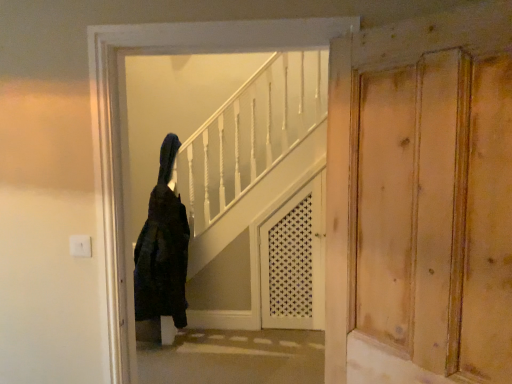
What are the coordinates of `white lattice screen door at center` in the screenshot? It's located at (294, 260).

This screenshot has height=384, width=512. Describe the element at coordinates (163, 248) in the screenshot. I see `black fuzzy coat at center` at that location.

The width and height of the screenshot is (512, 384). I want to click on black fuzzy coat at center, so click(x=163, y=248).

This screenshot has width=512, height=384. In order to click on white lattice screen door at center in this screenshot , I will do `click(294, 260)`.

Considering the relative sizes of black fuzzy coat at center and natural wood door at right in the image provided, is black fuzzy coat at center smaller than natural wood door at right?

No.

Which is nearer, (152, 244) or (340, 203)?

The point (340, 203) is more forward.

Would you consider black fuzzy coat at center to be distant from natural wood door at right?

Yes, black fuzzy coat at center and natural wood door at right are located far from each other.

How far apart are black fuzzy coat at center and natural wood door at right?

They are 1.97 meters apart.

Consider the image. Does white lattice screen door at center have a greater width compared to black fuzzy coat at center?

In fact, white lattice screen door at center might be narrower than black fuzzy coat at center.

Is black fuzzy coat at center inside white lattice screen door at center?

No, black fuzzy coat at center is located outside of white lattice screen door at center.

Considering the sizes of white lattice screen door at center and black fuzzy coat at center in the image, is white lattice screen door at center taller or shorter than black fuzzy coat at center?

Considering their sizes, white lattice screen door at center has more height than black fuzzy coat at center.

Does white lattice screen door at center have a smaller size compared to natural wood door at right?

No.

How much distance is there between white lattice screen door at center and natural wood door at right?

6.39 feet.

Is point (316, 186) positioned before point (494, 49)?

No, (316, 186) is further to viewer.

Is white lattice screen door at center touching natural wood door at right?

white lattice screen door at center and natural wood door at right are not in contact.

Between natural wood door at right and black fuzzy coat at center, which one has less height?

With less height is natural wood door at right.

Is natural wood door at right far from black fuzzy coat at center?

Yes, natural wood door at right and black fuzzy coat at center are quite far apart.

Does point (335, 287) lie behind point (170, 274)?

No, it is not.

Which object is further away from the camera, natural wood door at right or black fuzzy coat at center?

black fuzzy coat at center.

The image size is (512, 384). In order to click on screen door below the natural wood door at right (from a real-world perspective) in this screenshot , I will do `click(294, 260)`.

From the image's perspective, between natural wood door at right and white lattice screen door at center, which one is located above?

natural wood door at right, from the image's perspective.

From a real-world perspective, is natural wood door at right positioned above or below white lattice screen door at center?

natural wood door at right is situated higher than white lattice screen door at center in the real world.

Does natural wood door at right touch white lattice screen door at center?

There is a gap between natural wood door at right and white lattice screen door at center.

Measure the distance from black fuzzy coat at center to white lattice screen door at center.

black fuzzy coat at center is 33.91 inches away from white lattice screen door at center.

Considering the points (180, 323) and (272, 230), which point is behind, point (180, 323) or point (272, 230)?

The point (272, 230) is farther from the camera.

From a real-world perspective, is black fuzzy coat at center under white lattice screen door at center?

No, from a real-world perspective, black fuzzy coat at center is not under white lattice screen door at center.

From the image's perspective, is black fuzzy coat at center beneath white lattice screen door at center?

No, from the image's perspective, black fuzzy coat at center is not beneath white lattice screen door at center.

Find the location of a particular element. door that is in front of the black fuzzy coat at center is located at coordinates (355, 135).

Image resolution: width=512 pixels, height=384 pixels. What are the coordinates of `woman above the white lattice screen door at center (from the image's perspective)` in the screenshot? It's located at (163, 248).

Considering their positions, is white lattice screen door at center positioned further to natural wood door at right than black fuzzy coat at center?

black fuzzy coat at center.

When comparing their distances from natural wood door at right, does black fuzzy coat at center or white lattice screen door at center seem closer?

The object closer to natural wood door at right is white lattice screen door at center.

Estimate the real-world distances between objects in this image. Which object is further from black fuzzy coat at center, white lattice screen door at center or natural wood door at right?

natural wood door at right is positioned further to the anchor black fuzzy coat at center.

When comparing their distances from black fuzzy coat at center, does natural wood door at right or white lattice screen door at center seem further?

natural wood door at right is further to black fuzzy coat at center.

When comparing their distances from white lattice screen door at center, does natural wood door at right or black fuzzy coat at center seem further?

Among the two, natural wood door at right is located further to white lattice screen door at center.

From the image, which object appears to be nearer to white lattice screen door at center, black fuzzy coat at center or natural wood door at right?

Among the two, black fuzzy coat at center is located nearer to white lattice screen door at center.

I want to click on woman between natural wood door at right and white lattice screen door at center along the z-axis, so click(x=163, y=248).